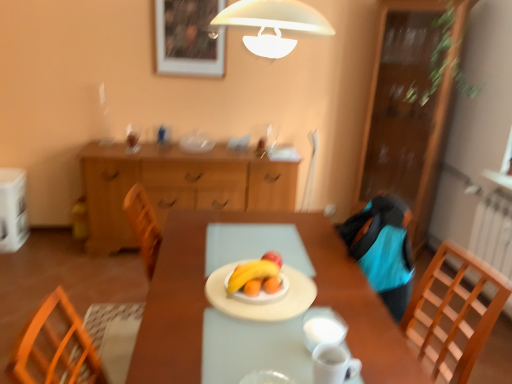
Find the location of a particular element. This screenshot has width=512, height=384. free spot above wooden table at center (from a real-world perspective) is located at coordinates (249, 259).